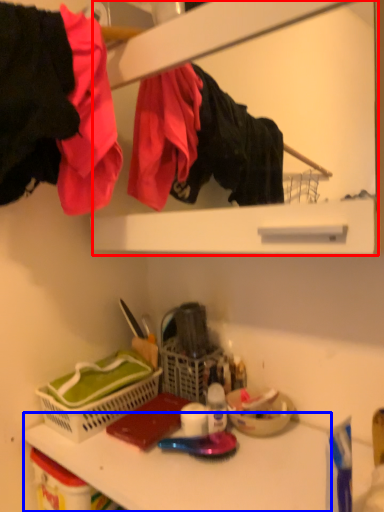
Question: Which point is closer to the camera, medicine cabinet (highlighted by a red box) or counter top (highlighted by a blue box)?

Choices:
 (A) medicine cabinet
 (B) counter top

Answer: (B)